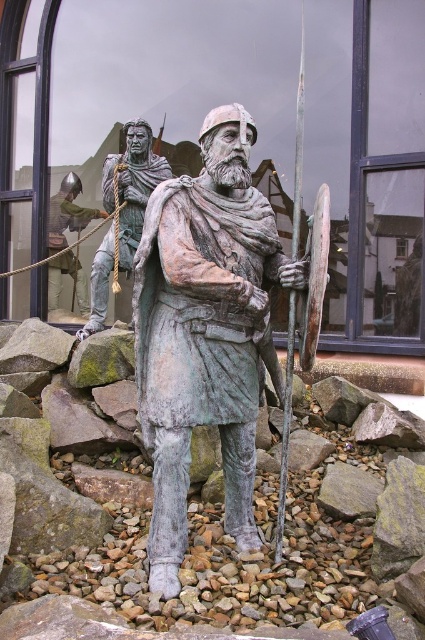
Does bronze statue at center come behind bronze warrior at left?

No, it is in front of bronze warrior at left.

Does point (149, 314) come in front of point (141, 193)?

Yes, point (149, 314) is closer to viewer.

Is point (144, 369) in front of point (139, 172)?

Yes, it is in front of point (139, 172).

Identify the location of bronze statue at center. (206, 332).

Does green patina statue at center appear over bronze statue at center?

Indeed, green patina statue at center is positioned over bronze statue at center.

This screenshot has height=640, width=425. I want to click on green patina statue at center, so click(x=132, y=92).

Does green patina statue at center have a lesser height compared to green fabric rope at upper left?

Yes.

Between green patina statue at center and green fabric rope at upper left, which one has more height?

With more height is green fabric rope at upper left.

Who is more forward, (93,248) or (70,204)?

Positioned in front is point (93,248).

I want to click on green patina statue at center, so click(132, 92).